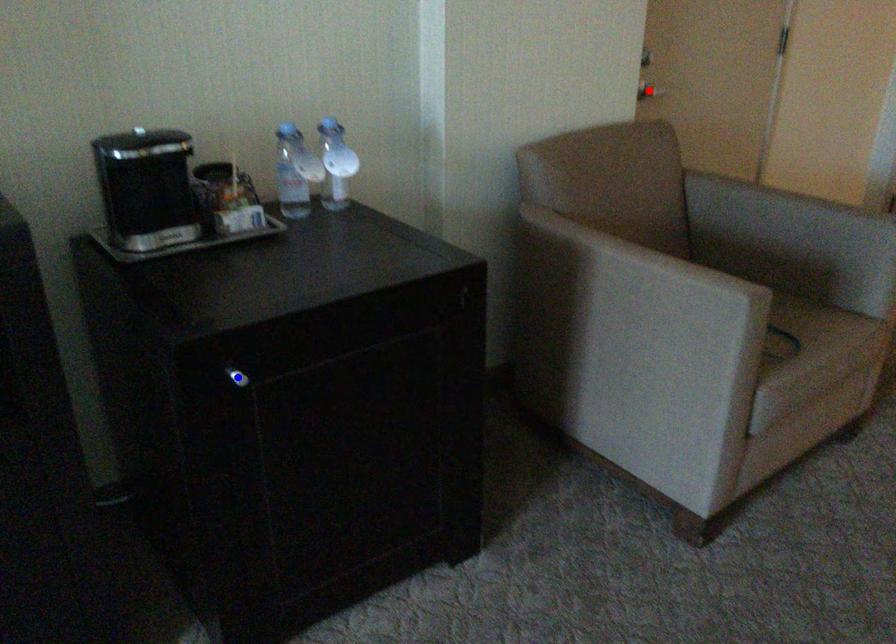
Question: Which of the two points in the image is closer to the camera?

Choices:
 (A) Blue point is closer.
 (B) Red point is closer.

Answer: (A)